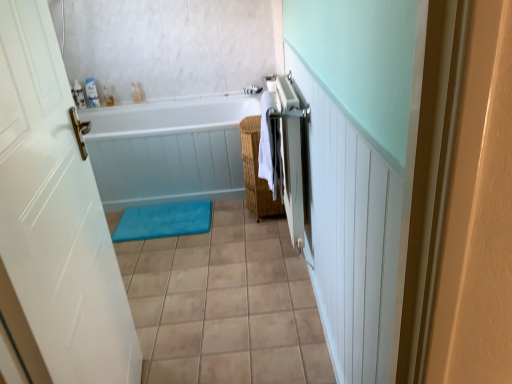
Question: Does white glossy door at left lie behind silver metallic towel rack at right?

Choices:
 (A) no
 (B) yes

Answer: (A)

Question: From the image's perspective, is white glossy door at left beneath silver metallic towel rack at right?

Choices:
 (A) no
 (B) yes

Answer: (B)

Question: Can you confirm if white glossy door at left is thinner than silver metallic towel rack at right?

Choices:
 (A) yes
 (B) no

Answer: (A)

Question: Is the surface of white glossy door at left in direct contact with silver metallic towel rack at right?

Choices:
 (A) no
 (B) yes

Answer: (A)

Question: From a real-world perspective, does white glossy door at left sit lower than silver metallic towel rack at right?

Choices:
 (A) no
 (B) yes

Answer: (A)

Question: Considering the positions of point (139, 225) and point (251, 205), is point (139, 225) closer or farther from the camera than point (251, 205)?

Choices:
 (A) closer
 (B) farther

Answer: (B)

Question: In terms of size, does blue soft bath mat at center appear bigger or smaller than woven brown basket at center-right?

Choices:
 (A) small
 (B) big

Answer: (A)

Question: Considering their positions, is blue soft bath mat at center located in front of or behind woven brown basket at center-right?

Choices:
 (A) front
 (B) behind

Answer: (B)

Question: Is blue soft bath mat at center situated inside woven brown basket at center-right or outside?

Choices:
 (A) outside
 (B) inside

Answer: (A)

Question: From the image's perspective, is woven brown basket at center-right located above or below silver metallic towel rack at right?

Choices:
 (A) above
 (B) below

Answer: (A)

Question: Would you say woven brown basket at center-right is inside or outside silver metallic towel rack at right?

Choices:
 (A) inside
 (B) outside

Answer: (B)

Question: From a real-world perspective, is woven brown basket at center-right above or below silver metallic towel rack at right?

Choices:
 (A) below
 (B) above

Answer: (A)

Question: In terms of height, does woven brown basket at center-right look taller or shorter compared to silver metallic towel rack at right?

Choices:
 (A) short
 (B) tall

Answer: (A)

Question: In terms of size, does woven brown basket at center-right appear bigger or smaller than white woven beach towel at center?

Choices:
 (A) big
 (B) small

Answer: (A)

Question: From a real-world perspective, is woven brown basket at center-right physically located above or below white woven beach towel at center?

Choices:
 (A) below
 (B) above

Answer: (A)